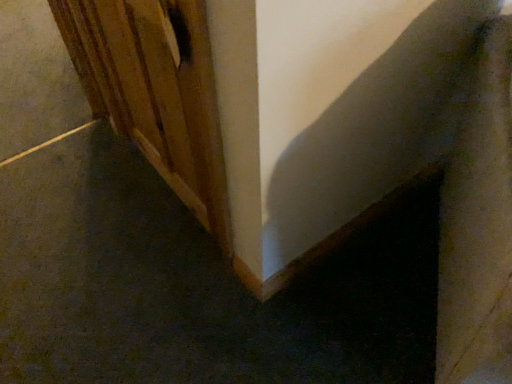
What do you see at coordinates (35, 79) in the screenshot? This screenshot has width=512, height=384. I see `smooth gray concrete at lower left` at bounding box center [35, 79].

What are the coordinates of `smooth gray concrete at lower left` in the screenshot? It's located at (35, 79).

Identify the location of wooden door at left. (155, 91).

Describe the element at coordinates (155, 91) in the screenshot. Image resolution: width=512 pixels, height=384 pixels. I see `wooden door at left` at that location.

Locate an element on the screen. smooth gray concrete at lower left is located at coordinates (35, 79).

Based on their positions, is wooden door at left located to the left or right of smooth gray concrete at lower left?

Based on their positions, wooden door at left is located to the right of smooth gray concrete at lower left.

Which is in front, wooden door at left or smooth gray concrete at lower left?

wooden door at left is closer to the camera.

Is point (79, 67) closer to camera compared to point (20, 30)?

Yes, point (79, 67) is in front of point (20, 30).

From the image's perspective, which object appears higher, wooden door at left or smooth gray concrete at lower left?

smooth gray concrete at lower left appears higher in the image.

From a real-world perspective, between wooden door at left and smooth gray concrete at lower left, who is vertically higher?

wooden door at left.

Considering the relative sizes of wooden door at left and smooth gray concrete at lower left in the image provided, is wooden door at left thinner than smooth gray concrete at lower left?

Correct, the width of wooden door at left is less than that of smooth gray concrete at lower left.

Can you confirm if wooden door at left is shorter than smooth gray concrete at lower left?

Incorrect, the height of wooden door at left does not fall short of that of smooth gray concrete at lower left.

Looking at this image, is wooden door at left bigger than smooth gray concrete at lower left?

No.

Is wooden door at left not inside smooth gray concrete at lower left?

That's correct, wooden door at left is outside of smooth gray concrete at lower left.

Are wooden door at left and smooth gray concrete at lower left making contact?

No, wooden door at left is not touching smooth gray concrete at lower left.

Is wooden door at left facing towards smooth gray concrete at lower left?

No.

Can you tell me how much wooden door at left and smooth gray concrete at lower left differ in facing direction?

88.7 degrees separate the facing orientations of wooden door at left and smooth gray concrete at lower left.

How distant is wooden door at left from smooth gray concrete at lower left?

They are 27.48 inches apart.

The width and height of the screenshot is (512, 384). Find the location of `door in front of the smooth gray concrete at lower left`. door in front of the smooth gray concrete at lower left is located at coordinates (155, 91).

From the picture: Based on their positions, is smooth gray concrete at lower left located to the left or right of wooden door at left?

smooth gray concrete at lower left is to the left of wooden door at left.

Which object is closer to the camera, smooth gray concrete at lower left or wooden door at left?

Answer: wooden door at left.

Is point (48, 112) farther from viewer compared to point (101, 52)?

Yes, point (48, 112) is farther from viewer.

From the image's perspective, is smooth gray concrete at lower left located beneath wooden door at left?

No, from the image's perspective, smooth gray concrete at lower left is not below wooden door at left.

From a real-world perspective, who is located lower, smooth gray concrete at lower left or wooden door at left?

From a 3D spatial view, smooth gray concrete at lower left is below.

In terms of width, does smooth gray concrete at lower left look wider or thinner when compared to wooden door at left?

smooth gray concrete at lower left is wider than wooden door at left.

Which of these two, smooth gray concrete at lower left or wooden door at left, stands shorter?

With less height is smooth gray concrete at lower left.

Considering the sizes of objects smooth gray concrete at lower left and wooden door at left in the image provided, who is smaller, smooth gray concrete at lower left or wooden door at left?

With smaller size is wooden door at left.

Is wooden door at left a part of smooth gray concrete at lower left?

No, wooden door at left is not a part of smooth gray concrete at lower left.

Is smooth gray concrete at lower left with wooden door at left?

smooth gray concrete at lower left and wooden door at left are not in contact.

Is smooth gray concrete at lower left oriented away from wooden door at left?

No, smooth gray concrete at lower left is not facing the opposite direction of wooden door at left.

What's the angular difference between smooth gray concrete at lower left and wooden door at left's facing directions?

88.7 degrees separate the facing orientations of smooth gray concrete at lower left and wooden door at left.

Identify the location of door that appears in front of the smooth gray concrete at lower left. (155, 91).

Image resolution: width=512 pixels, height=384 pixels. I want to click on concrete below the wooden door at left (from a real-world perspective), so click(35, 79).

I want to click on concrete above the wooden door at left (from the image's perspective), so click(x=35, y=79).